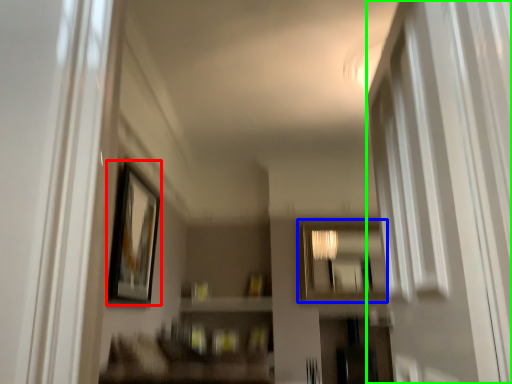
Question: Estimate the real-world distances between objects in this image. Which object is farther from picture frame (highlighted by a red box), mirror (highlighted by a blue box) or screen door (highlighted by a green box)?

Choices:
 (A) mirror
 (B) screen door

Answer: (A)